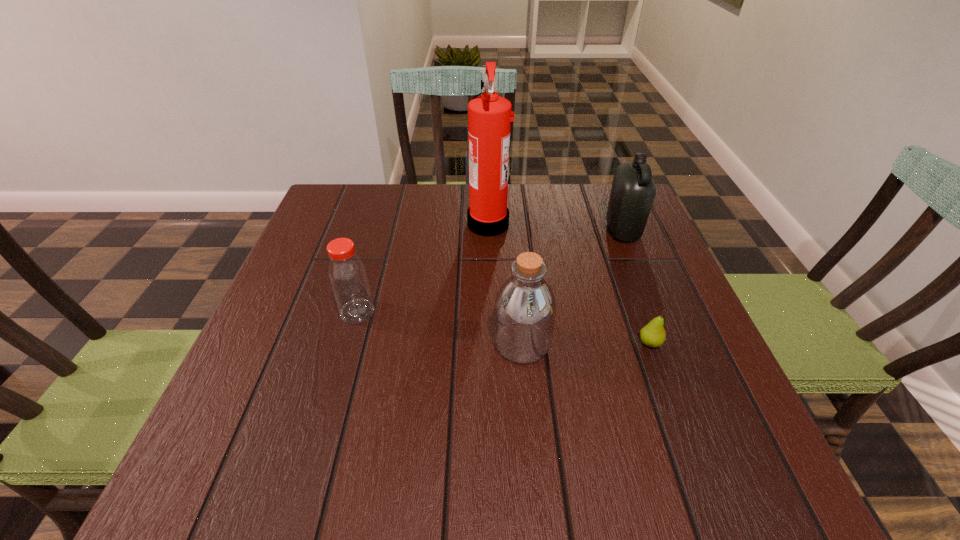
This screenshot has height=540, width=960. I want to click on object that is the second closest to the tallest object, so click(633, 191).

Locate which object ranks in proximity to the second bottle from right to left. Please provide its 2D coordinates. Your answer should be formatted as a tuple, i.e. [(x, y)], where the tuple contains the x and y coordinates of a point satisfying the conditions above.

[(653, 335)]

Identify which bottle is located as the nearest to the leftmost bottle. Please provide its 2D coordinates. Your answer should be formatted as a tuple, i.e. [(x, y)], where the tuple contains the x and y coordinates of a point satisfying the conditions above.

[(525, 307)]

Identify which bottle is the second closest to the fire extinguisher. Please provide its 2D coordinates. Your answer should be formatted as a tuple, i.e. [(x, y)], where the tuple contains the x and y coordinates of a point satisfying the conditions above.

[(633, 191)]

The height and width of the screenshot is (540, 960). In order to click on vacant area that satisfies the following two spatial constraints: 1. with the nozzle aimed from the tallest object; 2. on the back side of the farthest bottle in this screenshot , I will do `click(489, 231)`.

Locate an element on the screen. Image resolution: width=960 pixels, height=540 pixels. vacant region that satisfies the following two spatial constraints: 1. with the nozzle aimed from the tallest object; 2. on the front side of the shortest bottle is located at coordinates (491, 312).

Identify the location of vacant area that satisfies the following two spatial constraints: 1. on the back side of the shortest object; 2. on the right side of the rightmost bottle. pos(609,231).